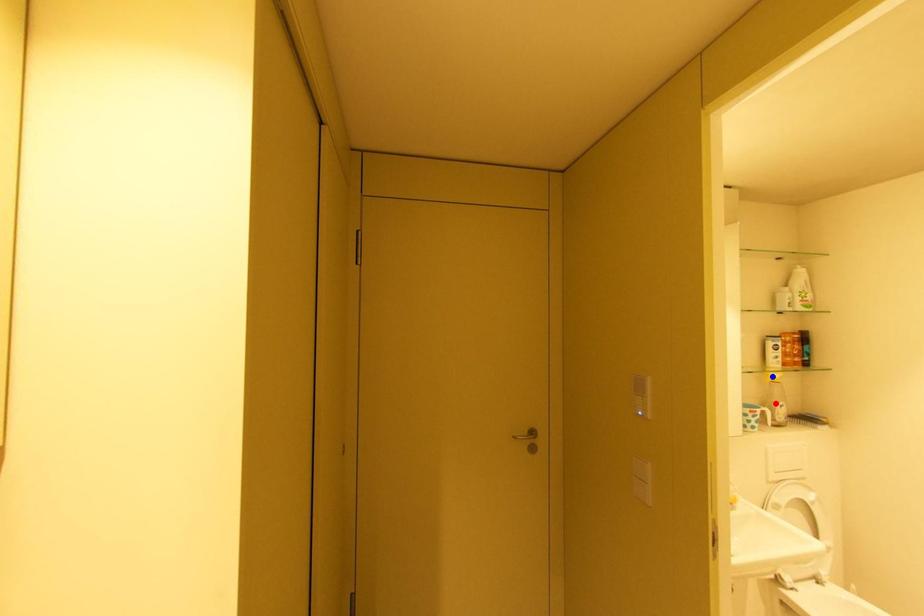
Question: Two points are marked on the image. Which point is closer to the camera?

Choices:
 (A) Blue point is closer.
 (B) Red point is closer.

Answer: (A)